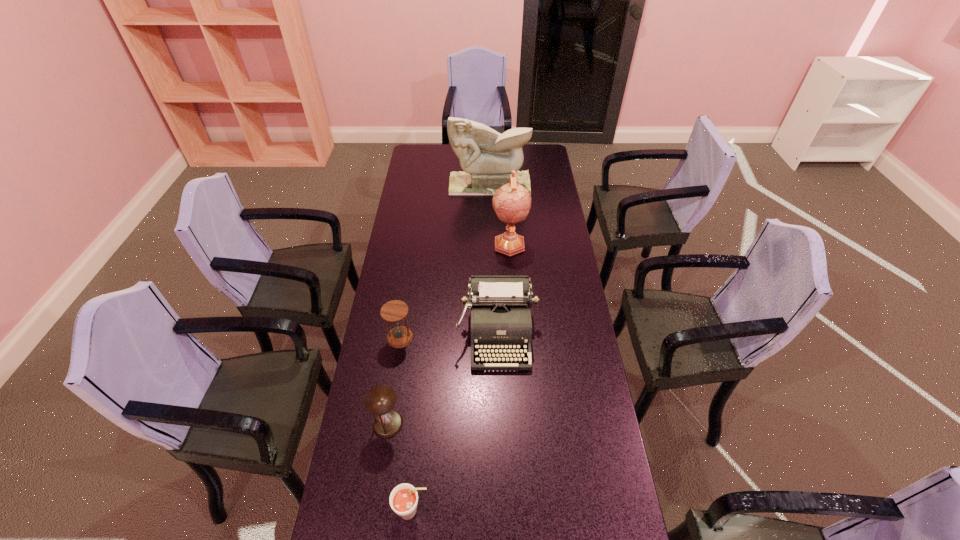
You are a GUI agent. You are given a task and a screenshot of the screen. Output one action in this format:
    pyautogui.click(x=<x>, y=<y>)
    Task: Click on the free space located 0.120m on the front of the nearer hourglass
    
    Given the screenshot: What is the action you would take?
    pyautogui.click(x=380, y=480)

You are a GUI agent. You are given a task and a screenshot of the screen. Output one action in this format:
    pyautogui.click(x=<x>, y=<y>)
    Task: Click on the vacant position located 0.130m on the drink side of the nearest object
    The image size is (960, 540).
    Given the screenshot: What is the action you would take?
    478,511

Image resolution: width=960 pixels, height=540 pixels. Find the location of `root beer at the left edge`. root beer at the left edge is located at coordinates (403, 499).

This screenshot has width=960, height=540. What are the coordinates of `object present at the right edge` in the screenshot? It's located at (486, 157).

Identify the location of free space at the far edge of the desktop. Image resolution: width=960 pixels, height=540 pixels. (444, 161).

Find the location of a particular element. vacant space at the left edge is located at coordinates (411, 356).

The image size is (960, 540). What are the coordinates of `vacant space at the right edge of the desktop` in the screenshot? It's located at (536, 199).

At what (x,y) coordinates should I click in order to perform the action: click on free spot between the globe and the farther hourglass. Please return your answer as a coordinate pair (x, y). The height and width of the screenshot is (540, 960). Looking at the image, I should click on (455, 291).

Locate an element on the screen. This screenshot has width=960, height=540. vacant space in between the farther hourglass and the root beer is located at coordinates (406, 424).

You are a GUI agent. You are given a task and a screenshot of the screen. Output one action in this format:
    pyautogui.click(x=<x>, y=<y>)
    Task: Click on the unoccupied area between the farther hourglass and the nearer hourglass
    This screenshot has width=960, height=540.
    Given the screenshot: What is the action you would take?
    pyautogui.click(x=394, y=381)